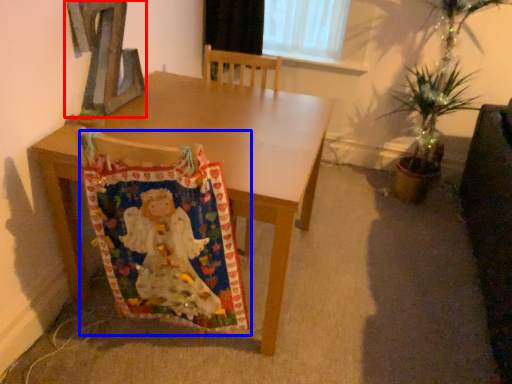
Question: Among these objects, which one is nearest to the camera, alphabet (highlighted by a red box) or blanket (highlighted by a blue box)?

Choices:
 (A) alphabet
 (B) blanket

Answer: (B)